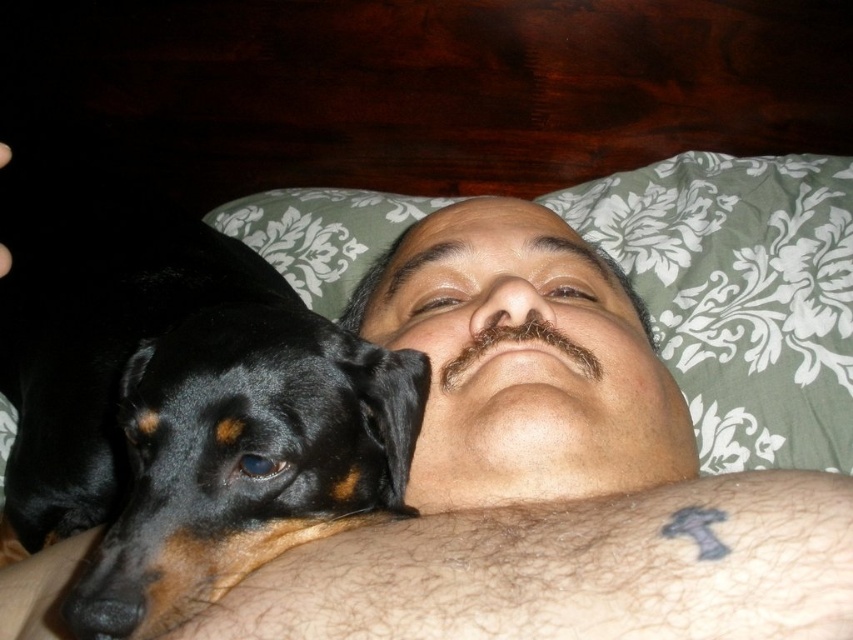
You are a photographer trying to capture a candid shot of the man and his dog. You notice two points marked on your camera screen at coordinates point (396,458) and point (335,266). Which point is closer to the camera?

Point (396,458) is in front of point (335,266), so it is closer to the camera.

You are a photographer trying to capture the black shiny dog at left and the green floral pillow at upper center in a single shot. Which object is shorter in height?

The black shiny dog at left is not as tall as the green floral pillow at upper center, so the dog is shorter in height.